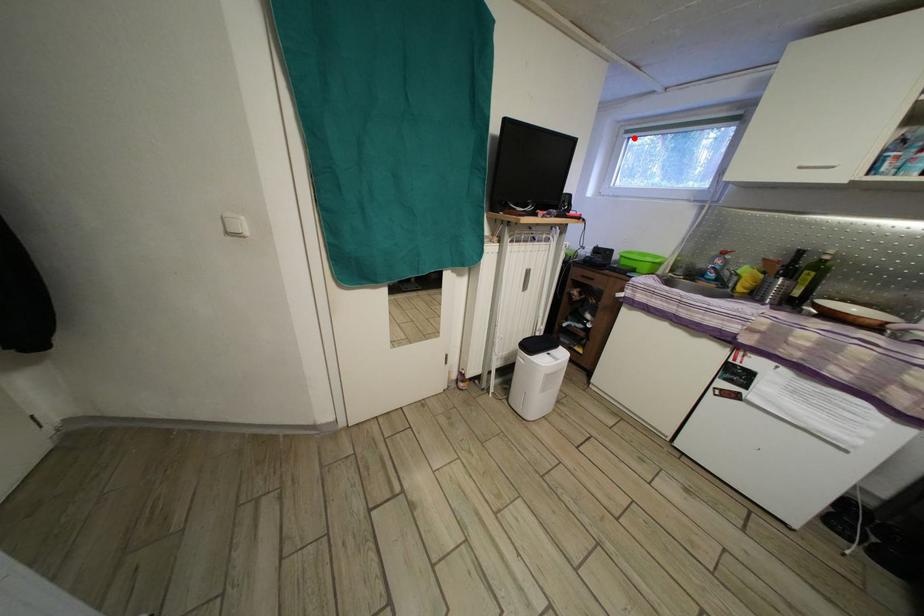
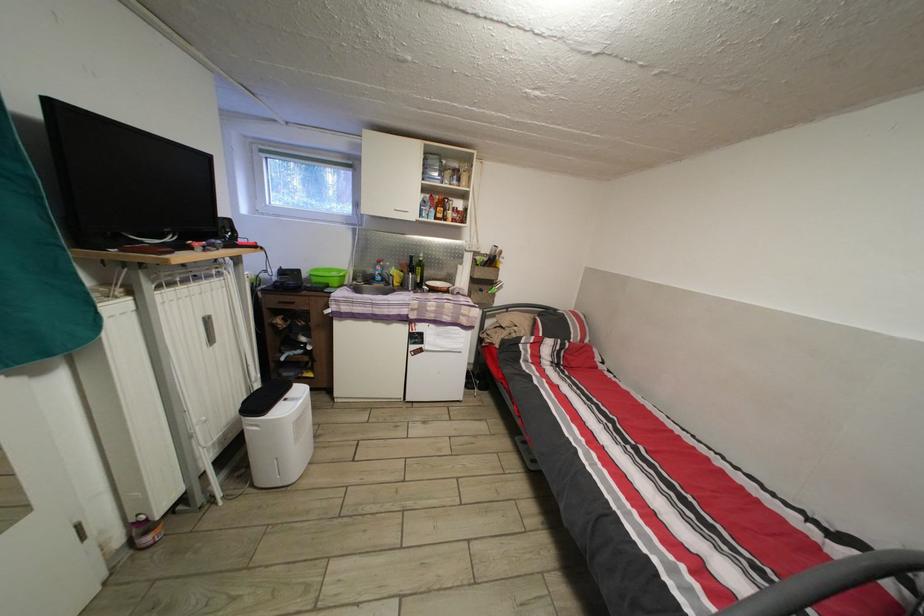
Question: I am providing you with two images of the same scene from different viewpoints. Image1 has a red point marked. In image2, the corresponding 3D location appears at what relative position? Reply with the corresponding letter.

Choices:
 (A) Closer
 (B) Farther

Answer: (B)